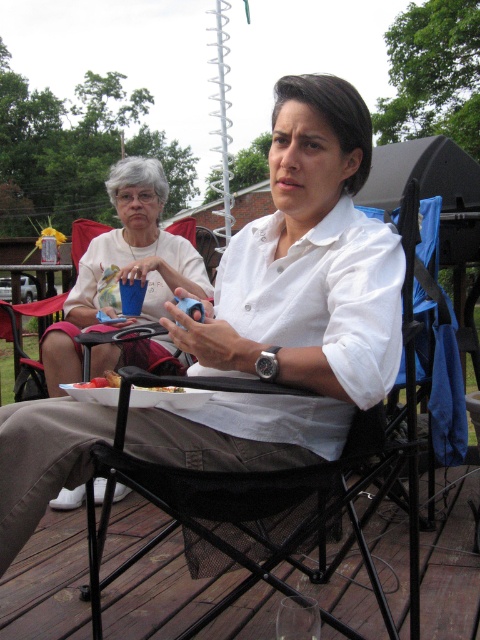
Which of these two, blue plastic cup at upper center or white paper plate at lower center, stands taller?

blue plastic cup at upper center

Measure the distance between blue plastic cup at upper center and white paper plate at lower center.

blue plastic cup at upper center is 1.23 meters away from white paper plate at lower center.

Who is more distant from viewer, (x=120, y=294) or (x=166, y=388)?

The point (x=120, y=294) is more distant.

Find the location of a particular element. The height and width of the screenshot is (640, 480). blue plastic cup at upper center is located at coordinates (132, 296).

Does brown wood deck at lower left have a smaller size compared to white matte shirt at upper center?

Yes, brown wood deck at lower left is smaller than white matte shirt at upper center.

Does brown wood deck at lower left have a lesser height compared to white matte shirt at upper center?

Yes, brown wood deck at lower left is shorter than white matte shirt at upper center.

Who is more forward, (x=47, y=586) or (x=90, y=246)?

Point (x=47, y=586)

Find the location of a particular element. brown wood deck at lower left is located at coordinates (48, 582).

Consider the image. Does brown wood deck at lower left appear on the right side of white paper plate at lower center?

Yes, brown wood deck at lower left is to the right of white paper plate at lower center.

Is brown wood deck at lower left positioned in front of white paper plate at lower center?

No, brown wood deck at lower left is behind white paper plate at lower center.

Describe the element at coordinates (48, 582) in the screenshot. I see `brown wood deck at lower left` at that location.

Locate an element on the screen. The width and height of the screenshot is (480, 640). brown wood deck at lower left is located at coordinates (48, 582).